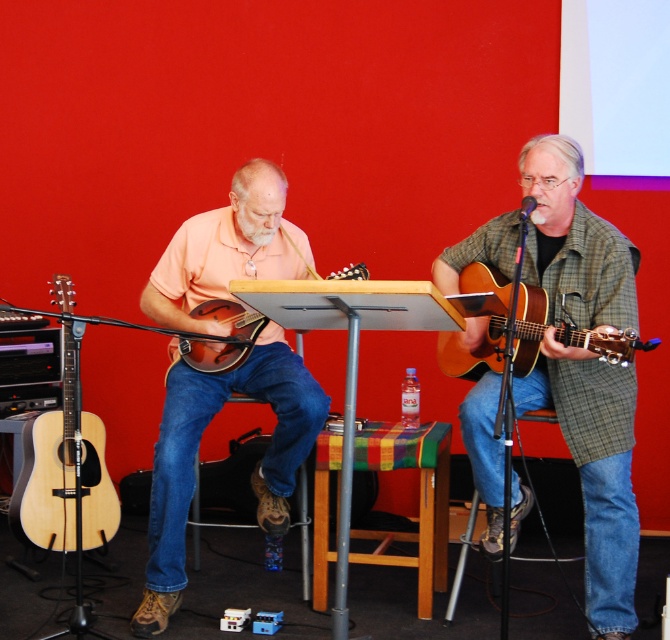
Can you confirm if matte orange mandolin at left is thinner than acoustic wood guitar at right?

In fact, matte orange mandolin at left might be wider than acoustic wood guitar at right.

Which is above, matte orange mandolin at left or acoustic wood guitar at right?

acoustic wood guitar at right is higher up.

Does point (143, 308) come farther from viewer compared to point (474, 289)?

Yes, point (143, 308) is behind point (474, 289).

What are the coordinates of `matte orange mandolin at left` in the screenshot? It's located at (198, 448).

Which of these two, natural wood acoustic guitar at left or matte brown acoustic guitar at center, stands taller?

With more height is natural wood acoustic guitar at left.

Does natural wood acoustic guitar at left have a lesser height compared to matte brown acoustic guitar at center?

In fact, natural wood acoustic guitar at left may be taller than matte brown acoustic guitar at center.

Between point (72, 394) and point (202, 344), which one is positioned behind?

The point (72, 394) is behind.

The width and height of the screenshot is (670, 640). I want to click on natural wood acoustic guitar at left, so pyautogui.click(x=48, y=468).

The height and width of the screenshot is (640, 670). I want to click on green plaid shirt at center, so click(x=596, y=468).

Is point (549, 228) positioned before point (318, 275)?

Yes, point (549, 228) is in front of point (318, 275).

This screenshot has width=670, height=640. In order to click on green plaid shirt at center in this screenshot , I will do `click(596, 468)`.